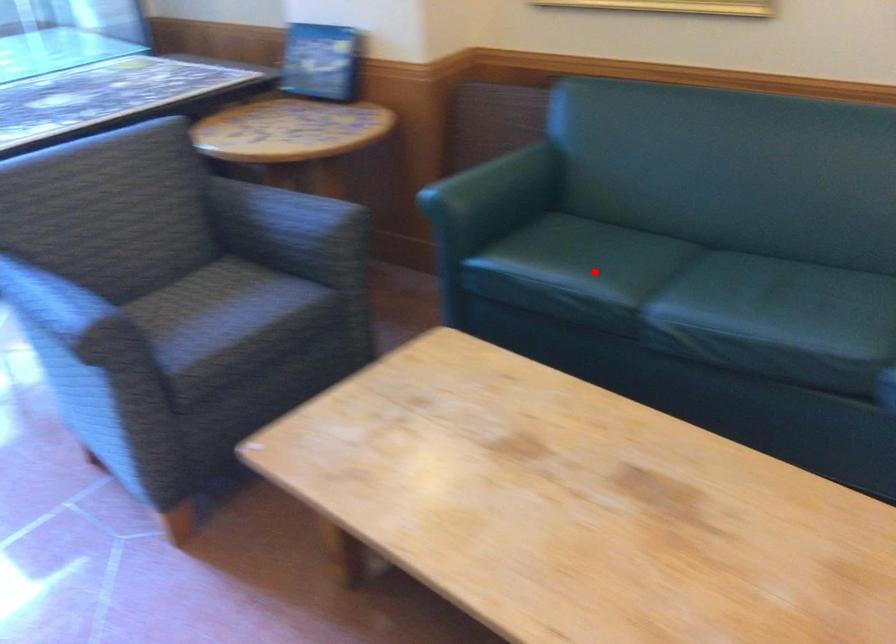
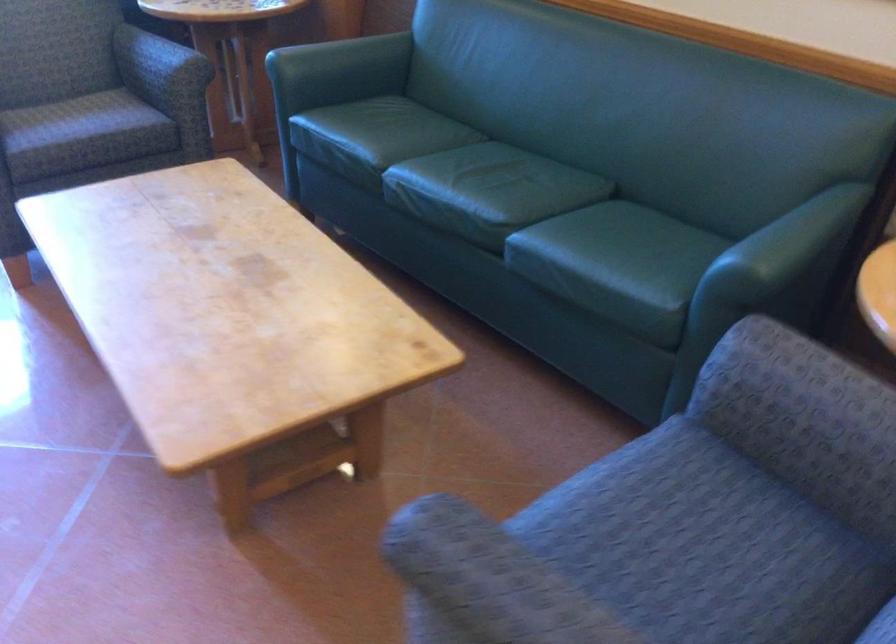
Question: I am providing you with two images of the same scene from different viewpoints. Given a red point in image1, look at the same physical point in image2. Is it:

Choices:
 (A) Closer to the viewpoint
 (B) Farther from the viewpoint

Answer: (B)